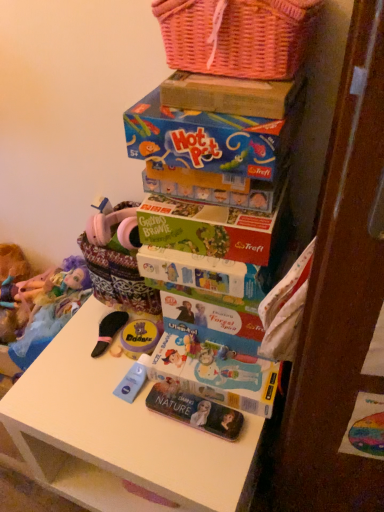
Question: Can you see green matte board game at center touching pink wicker basket at upper center?

Choices:
 (A) no
 (B) yes

Answer: (A)

Question: Could pink wicker basket at upper center be considered to be inside green matte board game at center?

Choices:
 (A) no
 (B) yes

Answer: (A)

Question: From the image's perspective, is green matte board game at center above pink wicker basket at upper center?

Choices:
 (A) no
 (B) yes

Answer: (A)

Question: Considering the relative sizes of green matte board game at center and pink wicker basket at upper center in the image provided, is green matte board game at center smaller than pink wicker basket at upper center?

Choices:
 (A) yes
 (B) no

Answer: (A)

Question: Can you confirm if green matte board game at center is shorter than pink wicker basket at upper center?

Choices:
 (A) yes
 (B) no

Answer: (A)

Question: From the image's perspective, is white matte table at center positioned above or below pink wicker basket at upper center?

Choices:
 (A) below
 (B) above

Answer: (A)

Question: Is white matte table at center to the left or to the right of pink wicker basket at upper center in the image?

Choices:
 (A) right
 (B) left

Answer: (B)

Question: Relative to pink wicker basket at upper center, is white matte table at center in front or behind?

Choices:
 (A) front
 (B) behind

Answer: (B)

Question: Is white matte table at center bigger or smaller than pink wicker basket at upper center?

Choices:
 (A) big
 (B) small

Answer: (A)

Question: Is matte yellow container at center, positioned as the first toy in right-to-left order, taller or shorter than blue cardboard hot pot game at upper center?

Choices:
 (A) tall
 (B) short

Answer: (B)

Question: Is matte yellow container at center, acting as the 1th toy starting from the front, spatially inside blue cardboard hot pot game at upper center, or outside of it?

Choices:
 (A) inside
 (B) outside

Answer: (B)

Question: From the image's perspective, is matte yellow container at center, marked as the 2th toy in a back-to-front arrangement, above or below blue cardboard hot pot game at upper center?

Choices:
 (A) below
 (B) above

Answer: (A)

Question: Relative to blue cardboard hot pot game at upper center, is matte yellow container at center, the 2th toy from the left, in front or behind?

Choices:
 (A) behind
 (B) front

Answer: (A)

Question: Considering their positions, is cardboard box at upper center located in front of or behind matte yellow container at center, the 2th toy from the left?

Choices:
 (A) front
 (B) behind

Answer: (A)

Question: From the image's perspective, is cardboard box at upper center located above or below matte yellow container at center, acting as the 1th toy starting from the front?

Choices:
 (A) above
 (B) below

Answer: (A)